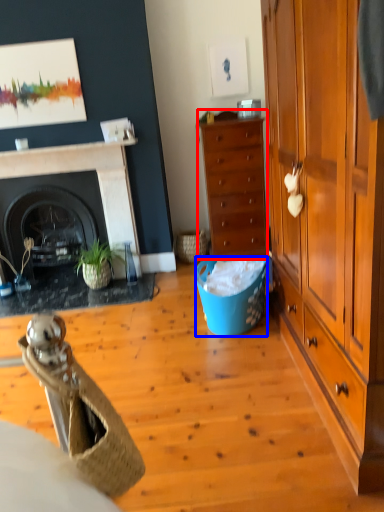
Question: Which of the following is the closest to the observer, cabinet (highlighted by a red box) or trash bin/can (highlighted by a blue box)?

Choices:
 (A) cabinet
 (B) trash bin/can

Answer: (B)